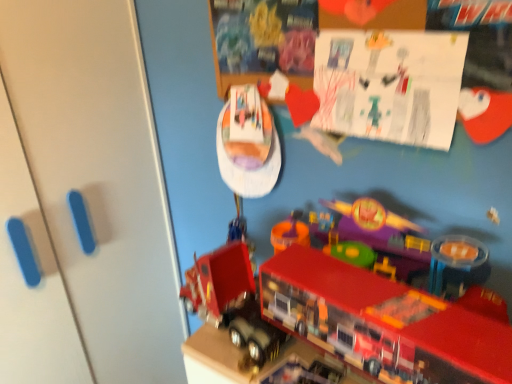
Question: From a real-world perspective, is shiny plastic fire truck at lower right, marked as the second toy in a top-to-bottom arrangement, under white matte door at left?

Choices:
 (A) no
 (B) yes

Answer: (A)

Question: Are shiny plastic fire truck at lower right, marked as the second toy in a top-to-bottom arrangement, and white matte door at left located far from each other?

Choices:
 (A) yes
 (B) no

Answer: (B)

Question: Does shiny plastic fire truck at lower right, marked as the second toy in a top-to-bottom arrangement, have a larger size compared to white matte door at left?

Choices:
 (A) no
 (B) yes

Answer: (A)

Question: Is shiny plastic fire truck at lower right, marked as the second toy in a top-to-bottom arrangement, to the right of white matte door at left from the viewer's perspective?

Choices:
 (A) yes
 (B) no

Answer: (A)

Question: From a real-world perspective, does shiny plastic fire truck at lower right, the 2th toy in the bottom-to-top sequence, stand above white matte door at left?

Choices:
 (A) no
 (B) yes

Answer: (B)

Question: Is shiny plastic fire truck at lower right, the 2th toy in the bottom-to-top sequence, inside the boundaries of shiny plastic toy truck at lower center, positioned as the third toy in top-to-bottom order, or outside?

Choices:
 (A) inside
 (B) outside

Answer: (B)

Question: In terms of height, does shiny plastic fire truck at lower right, marked as the second toy in a top-to-bottom arrangement, look taller or shorter compared to shiny plastic toy truck at lower center, positioned as the third toy in top-to-bottom order?

Choices:
 (A) short
 (B) tall

Answer: (B)

Question: Relative to shiny plastic toy truck at lower center, acting as the 1th toy starting from the bottom, is shiny plastic fire truck at lower right, marked as the second toy in a top-to-bottom arrangement, in front or behind?

Choices:
 (A) front
 (B) behind

Answer: (A)

Question: From the image's perspective, is shiny plastic fire truck at lower right, the 2th toy in the bottom-to-top sequence, located above or below shiny plastic toy truck at lower center, acting as the 1th toy starting from the bottom?

Choices:
 (A) below
 (B) above

Answer: (B)

Question: Considering their positions, is shiny plastic toy truck at lower center, acting as the 1th toy starting from the bottom, located in front of or behind shiny plastic fire truck at lower right, the 2th toy in the bottom-to-top sequence?

Choices:
 (A) front
 (B) behind

Answer: (B)

Question: Is shiny plastic toy truck at lower center, positioned as the third toy in top-to-bottom order, taller or shorter than shiny plastic fire truck at lower right, marked as the second toy in a top-to-bottom arrangement?

Choices:
 (A) tall
 (B) short

Answer: (B)

Question: From the image's perspective, is shiny plastic toy truck at lower center, acting as the 1th toy starting from the bottom, located above or below shiny plastic fire truck at lower right, marked as the second toy in a top-to-bottom arrangement?

Choices:
 (A) below
 (B) above

Answer: (A)

Question: From a real-world perspective, is shiny plastic toy truck at lower center, positioned as the third toy in top-to-bottom order, physically located above or below shiny plastic fire truck at lower right, the 2th toy in the bottom-to-top sequence?

Choices:
 (A) below
 (B) above

Answer: (A)

Question: Is shiny plastic toy truck at lower center, acting as the 1th toy starting from the bottom, bigger or smaller than white matte door at left?

Choices:
 (A) small
 (B) big

Answer: (A)

Question: Is shiny plastic toy truck at lower center, acting as the 1th toy starting from the bottom, taller or shorter than white matte door at left?

Choices:
 (A) tall
 (B) short

Answer: (B)